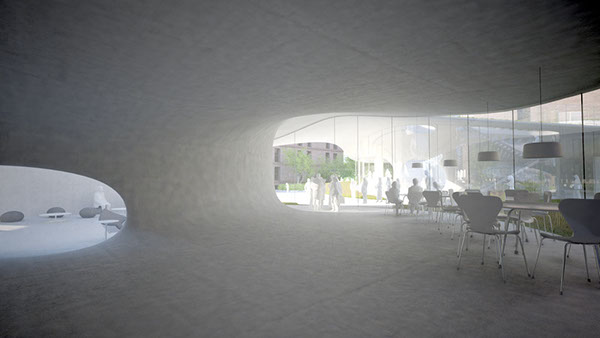
Locate an element on the screen. light bulb not in image is located at coordinates (543, 157), (488, 160), (449, 165), (419, 166).